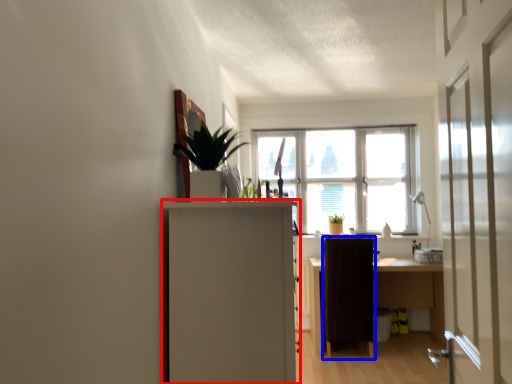
Question: Which object is further to the camera taking this photo, cabinetry (highlighted by a red box) or furniture (highlighted by a blue box)?

Choices:
 (A) cabinetry
 (B) furniture

Answer: (B)